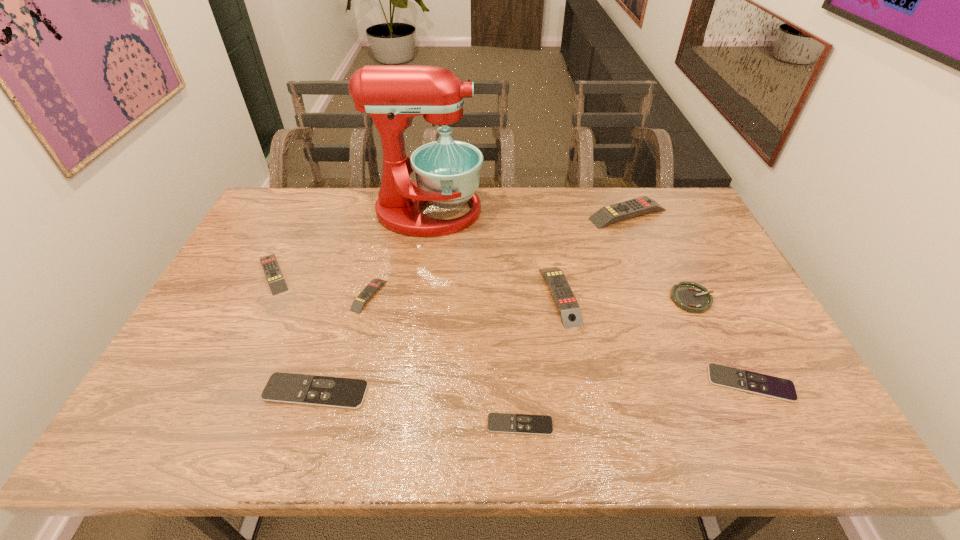
Find the location of a particular element. Image resolution: width=960 pixels, height=540 pixels. the smallest yellow remote control is located at coordinates (368, 292).

At what (x,y) coordinates should I click in order to perform the action: click on the third shortest object. Please return your answer as a coordinate pair (x, y). The image size is (960, 540). Looking at the image, I should click on (281, 387).

Image resolution: width=960 pixels, height=540 pixels. What are the coordinates of `the leftmost black remote control` in the screenshot? It's located at (281, 387).

Locate an element on the screen. the second shortest remote control is located at coordinates (757, 383).

Where is `the second shortest object`? the second shortest object is located at coordinates (757, 383).

Locate an element on the screen. The height and width of the screenshot is (540, 960). the nearest remote control is located at coordinates (497, 422).

The height and width of the screenshot is (540, 960). In order to click on the second black remote control from left to right in this screenshot , I will do point(497,422).

The width and height of the screenshot is (960, 540). Find the location of `free space located on the front-facing side of the tallest object`. free space located on the front-facing side of the tallest object is located at coordinates (595, 212).

You are a GUI agent. You are given a task and a screenshot of the screen. Output one action in this format:
    pyautogui.click(x=<x>, y=<y>)
    Task: Click on the free space located 0.050m on the back of the second tallest object
    The image size is (960, 540).
    Given the screenshot: What is the action you would take?
    pyautogui.click(x=619, y=193)

Locate an element on the screen. The width and height of the screenshot is (960, 540). vacant point located on the front of the fifth remote control from left to right is located at coordinates (586, 438).